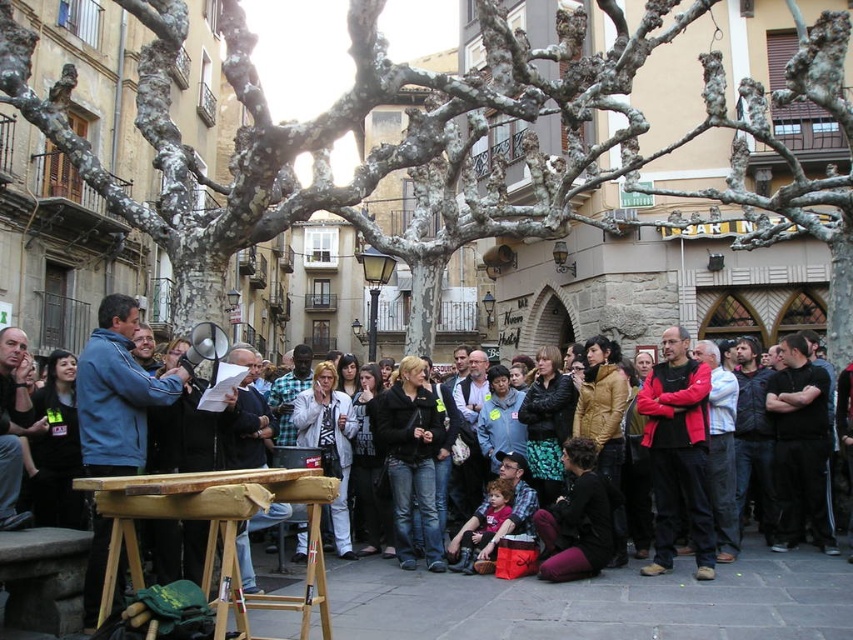
Question: Where is gray bark tree at center located in relation to matte black jacket at center in the image?

Choices:
 (A) left
 (B) right

Answer: (A)

Question: Which point is closer to the camera taking this photo?

Choices:
 (A) (671, 348)
 (B) (122, 452)
 (C) (426, 593)
 (D) (848, 291)

Answer: (B)

Question: Which point is farther to the camera?

Choices:
 (A) (645, 432)
 (B) (492, 202)
 (C) (173, 390)

Answer: (B)

Question: Which object is closer to the camera taking this photo?

Choices:
 (A) gray bark tree at center
 (B) red fleece jacket at center

Answer: (A)

Question: Observing the image, what is the correct spatial positioning of gray bark tree at center in reference to matte black jacket at center?

Choices:
 (A) below
 (B) above

Answer: (B)

Question: Does blue fleece jacket at left appear under red fleece jacket at center?

Choices:
 (A) yes
 (B) no

Answer: (B)